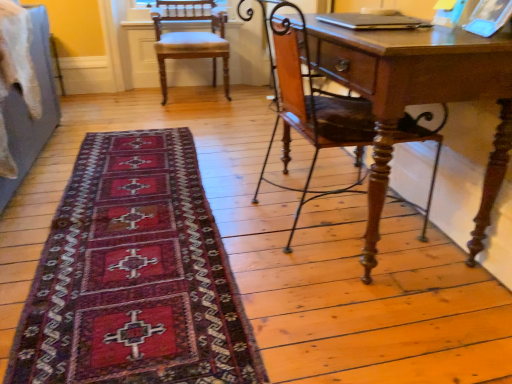
Find the location of a particular element. The height and width of the screenshot is (384, 512). vacant space in dark red woven rug at lower left (from a real-world perspective) is located at coordinates (138, 225).